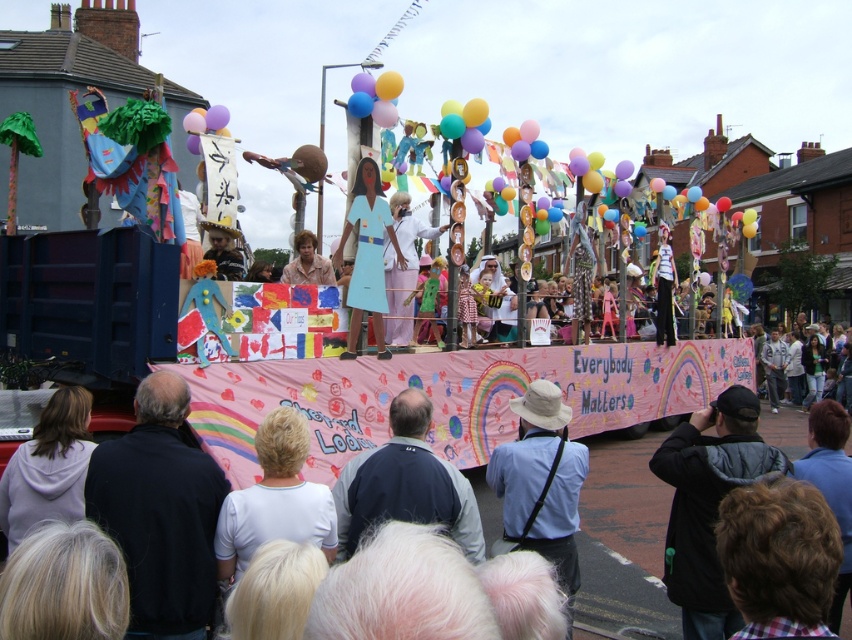
In the scene shown: You are a photographer standing at the center of the parade. You want to take a photo that includes both the point at coordinates point [130,481] and point [378,216]. Which point should you focus on first to ensure both are in focus?

You should focus on point [130,481] first because it is closer to the camera than point [378,216]. This ensures that both points will be within the depth of field.

You are a photographer at the parade and want to capture a photo that includes both the brown hair at lower right and the pink fabric dress at center. Based on their positions, which object should you place on the right side of your camera frame?

The brown hair at lower right should be placed on the right side of your camera frame since it is already positioned to the right of the pink fabric dress at center in the scene.